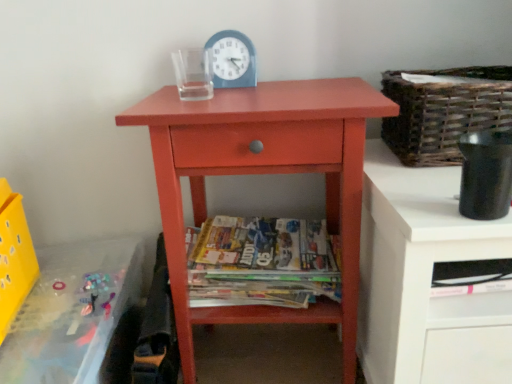
Image resolution: width=512 pixels, height=384 pixels. What are the coordinates of `free point above printed paper magazines at center (from a real-world perspective)` in the screenshot? It's located at (252, 236).